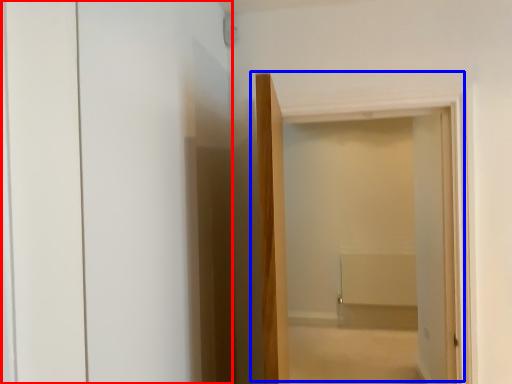
Question: Among these objects, which one is nearest to the camera, screen door (highlighted by a red box) or door (highlighted by a blue box)?

Choices:
 (A) screen door
 (B) door

Answer: (A)